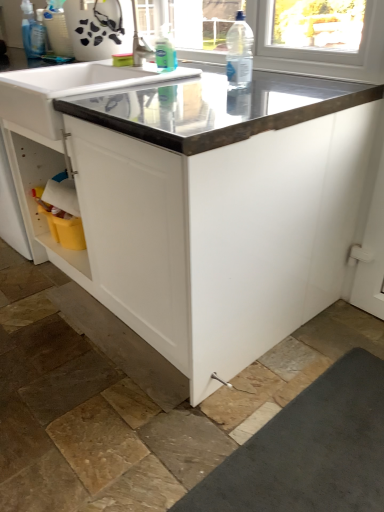
You are a GUI agent. You are given a task and a screenshot of the screen. Output one action in this format:
    pyautogui.click(x=<x>, y=<y>)
    Task: Click on the free space that is to the left of clear plastic bottle at upper center
    This screenshot has width=384, height=512.
    Given the screenshot: What is the action you would take?
    pyautogui.click(x=185, y=87)